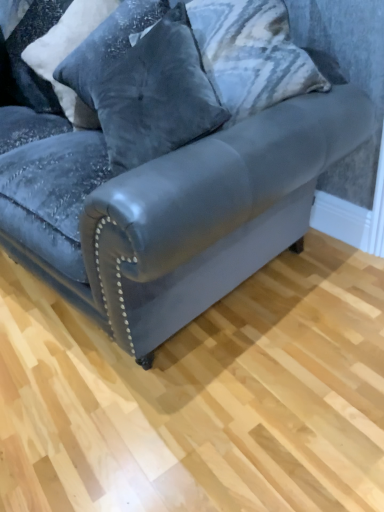
The height and width of the screenshot is (512, 384). What do you see at coordinates (157, 96) in the screenshot? I see `velvet gray pillow at upper center, placed as the 1th pillow when sorted from right to left` at bounding box center [157, 96].

How much space does velvet gray pillow at upper center, which appears as the 4th pillow when viewed from the left, occupy vertically?

velvet gray pillow at upper center, which appears as the 4th pillow when viewed from the left, is 24.16 inches tall.

Measure the distance between point (47, 91) and camera.

7.08 feet.

The image size is (384, 512). Describe the element at coordinates (68, 54) in the screenshot. I see `velvet dark gray pillow at upper left, which ranks as the 2th pillow in left-to-right order` at that location.

How much space does velvet dark gray pillow at upper left, which ranks as the 2th pillow in left-to-right order, occupy vertically?

21.99 inches.

Describe the element at coordinates (169, 210) in the screenshot. I see `velvet dark blue couch at center` at that location.

Identify the location of velvet gray pillow at upper center, which appears as the 4th pillow when viewed from the left. (157, 96).

How far apart are velvet dark gray pillow at upper left, which ranks as the 2th pillow in left-to-right order, and velvet gray pillow at upper center, placed as the 1th pillow when sorted from right to left?

24.85 inches.

Is velvet dark gray pillow at upper left, which is the third pillow in right-to-left order, shorter than velvet gray pillow at upper center, placed as the 1th pillow when sorted from right to left?

Yes, velvet dark gray pillow at upper left, which is the third pillow in right-to-left order, is shorter than velvet gray pillow at upper center, placed as the 1th pillow when sorted from right to left.

Is the position of velvet dark gray pillow at upper left, which ranks as the 2th pillow in left-to-right order, more distant than that of velvet gray pillow at upper center, placed as the 1th pillow when sorted from right to left?

Yes, it is behind velvet gray pillow at upper center, placed as the 1th pillow when sorted from right to left.

From the image's perspective, who appears lower, velvet dark gray pillow at upper left, which ranks as the 2th pillow in left-to-right order, or velvet gray pillow at upper center, which appears as the 4th pillow when viewed from the left?

velvet gray pillow at upper center, which appears as the 4th pillow when viewed from the left, is shown below in the image.

Is velvet dark gray pillow at upper left, which is the third pillow in right-to-left order, taller than velvet dark blue pillow at upper left, placed as the 1th pillow when sorted from left to right?

Yes.

Is velvet dark gray pillow at upper left, which is the third pillow in right-to-left order, positioned beyond the bounds of velvet dark blue pillow at upper left, placed as the 1th pillow when sorted from left to right?

Yes, velvet dark gray pillow at upper left, which is the third pillow in right-to-left order, is located beyond the bounds of velvet dark blue pillow at upper left, placed as the 1th pillow when sorted from left to right.

Which of these two, velvet dark gray pillow at upper left, which ranks as the 2th pillow in left-to-right order, or velvet dark blue pillow at upper left, the 4th pillow when ordered from right to left, is smaller?

velvet dark blue pillow at upper left, the 4th pillow when ordered from right to left.

Locate an element on the screen. pillow that is the 1st one below the velvet dark blue pillow at upper left, the 4th pillow when ordered from right to left (from a real-world perspective) is located at coordinates (68, 54).

Considering the relative sizes of velvet gray pillow at upper center, which appears as the 4th pillow when viewed from the left, and velvet pillow at upper left, which appears as the 2th pillow when viewed from the right, in the image provided, is velvet gray pillow at upper center, which appears as the 4th pillow when viewed from the left, thinner than velvet pillow at upper left, which appears as the 2th pillow when viewed from the right,?

No.

From the image's perspective, does velvet gray pillow at upper center, which appears as the 4th pillow when viewed from the left, appear lower than velvet pillow at upper left, which appears as the 2th pillow when viewed from the right?

Indeed, from the image's perspective, velvet gray pillow at upper center, which appears as the 4th pillow when viewed from the left, is shown beneath velvet pillow at upper left, which appears as the 2th pillow when viewed from the right.

Does velvet gray pillow at upper center, which appears as the 4th pillow when viewed from the left, lie behind velvet pillow at upper left, which appears as the 2th pillow when viewed from the right?

No, the depth of velvet gray pillow at upper center, which appears as the 4th pillow when viewed from the left, is less than that of velvet pillow at upper left, which appears as the 2th pillow when viewed from the right.

How many degrees apart are the facing directions of velvet gray pillow at upper center, which appears as the 4th pillow when viewed from the left, and velvet pillow at upper left, positioned as the third pillow in left-to-right order?

They differ by 0.000303 degrees in their facing directions.

What's the angular difference between velvet dark blue pillow at upper left, placed as the 1th pillow when sorted from left to right, and velvet pillow at upper left, which appears as the 2th pillow when viewed from the right,'s facing directions?

0.00133 degrees separate the facing orientations of velvet dark blue pillow at upper left, placed as the 1th pillow when sorted from left to right, and velvet pillow at upper left, which appears as the 2th pillow when viewed from the right.

In the scene shown: Considering the sizes of objects velvet dark blue pillow at upper left, the 4th pillow when ordered from right to left, and velvet pillow at upper left, which appears as the 2th pillow when viewed from the right, in the image provided, who is shorter, velvet dark blue pillow at upper left, the 4th pillow when ordered from right to left, or velvet pillow at upper left, which appears as the 2th pillow when viewed from the right,?

With less height is velvet dark blue pillow at upper left, the 4th pillow when ordered from right to left.

Considering the relative sizes of velvet dark blue pillow at upper left, the 4th pillow when ordered from right to left, and velvet pillow at upper left, positioned as the third pillow in left-to-right order, in the image provided, is velvet dark blue pillow at upper left, the 4th pillow when ordered from right to left, bigger than velvet pillow at upper left, positioned as the third pillow in left-to-right order,?

Actually, velvet dark blue pillow at upper left, the 4th pillow when ordered from right to left, might be smaller than velvet pillow at upper left, positioned as the third pillow in left-to-right order.

Where is `the 2nd pillow above the velvet pillow at upper left, positioned as the third pillow in left-to-right order (from a real-world perspective)`? Image resolution: width=384 pixels, height=512 pixels. the 2nd pillow above the velvet pillow at upper left, positioned as the third pillow in left-to-right order (from a real-world perspective) is located at coordinates (22, 51).

Which is more to the right, velvet dark blue pillow at upper left, placed as the 1th pillow when sorted from left to right, or velvet gray pillow at upper center, placed as the 1th pillow when sorted from right to left?

velvet gray pillow at upper center, placed as the 1th pillow when sorted from right to left.

Can you confirm if velvet dark blue pillow at upper left, placed as the 1th pillow when sorted from left to right, is taller than velvet gray pillow at upper center, placed as the 1th pillow when sorted from right to left?

In fact, velvet dark blue pillow at upper left, placed as the 1th pillow when sorted from left to right, may be shorter than velvet gray pillow at upper center, placed as the 1th pillow when sorted from right to left.

Is velvet pillow at upper left, which appears as the 2th pillow when viewed from the right, looking in the opposite direction of velvet dark blue couch at center?

That's right, velvet pillow at upper left, which appears as the 2th pillow when viewed from the right, is facing away from velvet dark blue couch at center.

Considering the positions of objects velvet pillow at upper left, positioned as the third pillow in left-to-right order, and velvet dark blue couch at center in the image provided, who is in front, velvet pillow at upper left, positioned as the third pillow in left-to-right order, or velvet dark blue couch at center?

velvet dark blue couch at center.

From a real-world perspective, is velvet pillow at upper left, positioned as the third pillow in left-to-right order, above or below velvet dark blue couch at center?

velvet pillow at upper left, positioned as the third pillow in left-to-right order, is above velvet dark blue couch at center.

Is velvet pillow at upper left, positioned as the third pillow in left-to-right order, aimed at velvet dark gray pillow at upper left, which is the third pillow in right-to-left order?

No, velvet pillow at upper left, positioned as the third pillow in left-to-right order, does not turn towards velvet dark gray pillow at upper left, which is the third pillow in right-to-left order.

From the image's perspective, which object appears higher, velvet pillow at upper left, which appears as the 2th pillow when viewed from the right, or velvet dark gray pillow at upper left, which ranks as the 2th pillow in left-to-right order?

From the image's view, velvet dark gray pillow at upper left, which ranks as the 2th pillow in left-to-right order, is above.

Can you confirm if velvet pillow at upper left, which appears as the 2th pillow when viewed from the right, is bigger than velvet dark gray pillow at upper left, which ranks as the 2th pillow in left-to-right order?

Indeed, velvet pillow at upper left, which appears as the 2th pillow when viewed from the right, has a larger size compared to velvet dark gray pillow at upper left, which ranks as the 2th pillow in left-to-right order.

Can you tell me how much velvet pillow at upper left, positioned as the third pillow in left-to-right order, and velvet dark gray pillow at upper left, which ranks as the 2th pillow in left-to-right order, differ in facing direction?

There is a 0.000648-degree angle between the facing directions of velvet pillow at upper left, positioned as the third pillow in left-to-right order, and velvet dark gray pillow at upper left, which ranks as the 2th pillow in left-to-right order.

Where is `pillow that is the 2nd one when counting upward from the velvet gray pillow at upper center, which appears as the 4th pillow when viewed from the left (from the image's perspective)`? The height and width of the screenshot is (512, 384). pillow that is the 2nd one when counting upward from the velvet gray pillow at upper center, which appears as the 4th pillow when viewed from the left (from the image's perspective) is located at coordinates (68, 54).

Identify the location of the 1st pillow below the velvet dark blue pillow at upper left, the 4th pillow when ordered from right to left (from a real-world perspective). The image size is (384, 512). (68, 54).

When comparing their distances from velvet gray pillow at upper center, placed as the 1th pillow when sorted from right to left, does velvet dark blue pillow at upper left, the 4th pillow when ordered from right to left, or velvet dark blue couch at center seem closer?

velvet dark blue couch at center.

Estimate the real-world distances between objects in this image. Which object is closer to velvet dark blue couch at center, velvet dark blue pillow at upper left, placed as the 1th pillow when sorted from left to right, or velvet gray pillow at upper center, placed as the 1th pillow when sorted from right to left?

Among the two, velvet gray pillow at upper center, placed as the 1th pillow when sorted from right to left, is located nearer to velvet dark blue couch at center.

From the image, which object appears to be nearer to velvet dark blue couch at center, velvet gray pillow at upper center, placed as the 1th pillow when sorted from right to left, or velvet dark blue pillow at upper left, placed as the 1th pillow when sorted from left to right?

The object closer to velvet dark blue couch at center is velvet gray pillow at upper center, placed as the 1th pillow when sorted from right to left.

Estimate the real-world distances between objects in this image. Which object is closer to velvet dark blue couch at center, velvet dark gray pillow at upper left, which is the third pillow in right-to-left order, or velvet dark blue pillow at upper left, the 4th pillow when ordered from right to left?

Among the two, velvet dark gray pillow at upper left, which is the third pillow in right-to-left order, is located nearer to velvet dark blue couch at center.

Looking at the image, which one is located further to velvet dark blue pillow at upper left, the 4th pillow when ordered from right to left, velvet pillow at upper left, positioned as the third pillow in left-to-right order, or velvet dark blue couch at center?

Based on the image, velvet dark blue couch at center appears to be further to velvet dark blue pillow at upper left, the 4th pillow when ordered from right to left.

From the image, which object appears to be farther from velvet dark gray pillow at upper left, which ranks as the 2th pillow in left-to-right order, velvet dark blue couch at center or velvet pillow at upper left, which appears as the 2th pillow when viewed from the right?

The object further to velvet dark gray pillow at upper left, which ranks as the 2th pillow in left-to-right order, is velvet dark blue couch at center.

Looking at the image, which one is located further to velvet gray pillow at upper center, which appears as the 4th pillow when viewed from the left, velvet dark blue couch at center or velvet pillow at upper left, which appears as the 2th pillow when viewed from the right?

velvet dark blue couch at center is positioned further to the anchor velvet gray pillow at upper center, which appears as the 4th pillow when viewed from the left.

Which object lies further to the anchor point velvet pillow at upper left, which appears as the 2th pillow when viewed from the right, velvet dark blue couch at center or velvet dark gray pillow at upper left, which is the third pillow in right-to-left order?

Among the two, velvet dark blue couch at center is located further to velvet pillow at upper left, which appears as the 2th pillow when viewed from the right.

Where is `pillow positioned between velvet dark blue couch at center and velvet pillow at upper left, positioned as the third pillow in left-to-right order, from near to far`? This screenshot has height=512, width=384. pillow positioned between velvet dark blue couch at center and velvet pillow at upper left, positioned as the third pillow in left-to-right order, from near to far is located at coordinates (157, 96).

Identify the location of pillow between velvet dark blue pillow at upper left, placed as the 1th pillow when sorted from left to right, and velvet pillow at upper left, which appears as the 2th pillow when viewed from the right. (68, 54).

You are a GUI agent. You are given a task and a screenshot of the screen. Output one action in this format:
    pyautogui.click(x=<x>, y=<y>)
    Task: Click on the pillow located between velvet gray pillow at upper center, placed as the 1th pillow when sorted from right to left, and velvet dark gray pillow at upper left, which ranks as the 2th pillow in left-to-right order, in the depth direction
    The width and height of the screenshot is (384, 512).
    Given the screenshot: What is the action you would take?
    pyautogui.click(x=104, y=53)